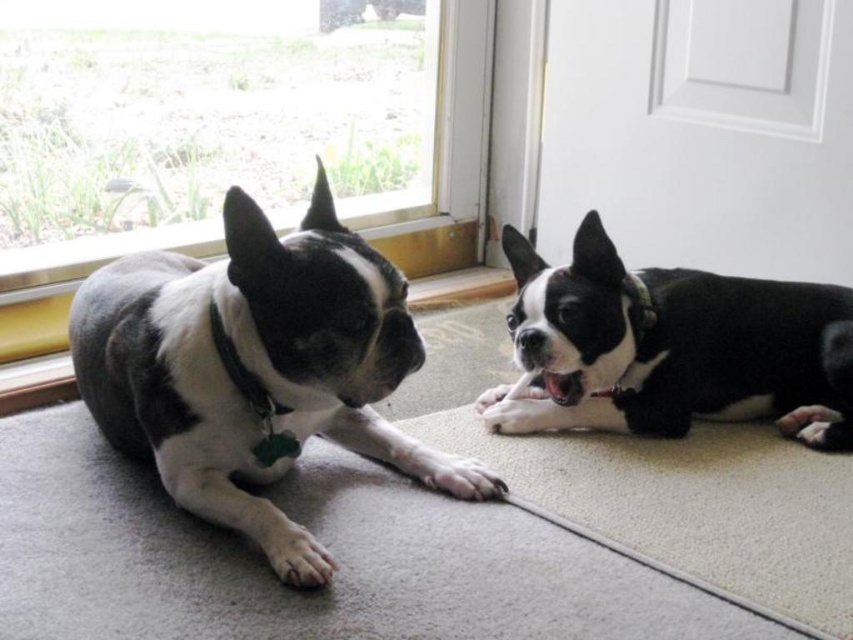
Question: Is white glossy door at upper right further to the viewer compared to black matte dog at right?

Choices:
 (A) yes
 (B) no

Answer: (A)

Question: Which of the following is the farthest from the observer?

Choices:
 (A) (589, 193)
 (B) (96, 317)
 (C) (527, 248)

Answer: (A)

Question: Is black and white fur at left positioned before white glossy door at upper right?

Choices:
 (A) no
 (B) yes

Answer: (B)

Question: Which object is positioned closest to the white glossy door at upper right?

Choices:
 (A) black matte dog at right
 (B) black and white fur at left

Answer: (A)

Question: Is black and white fur at left below white glossy door at upper right?

Choices:
 (A) no
 (B) yes

Answer: (B)

Question: Which object appears closest to the camera in this image?

Choices:
 (A) black and white fur at left
 (B) black matte dog at right

Answer: (A)